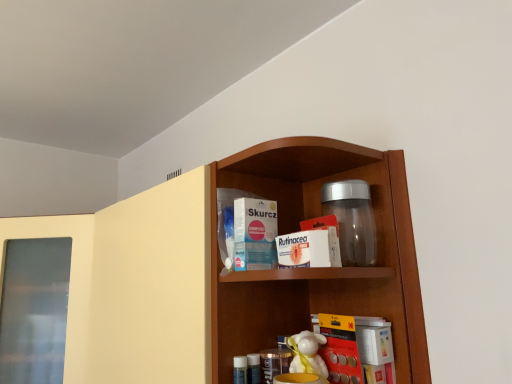
Question: Is wooden shelf at center turned away from yellow matte book at lower center?

Choices:
 (A) yes
 (B) no

Answer: (B)

Question: From the image's perspective, is wooden shelf at center on yellow matte book at lower center?

Choices:
 (A) no
 (B) yes

Answer: (A)

Question: Is wooden shelf at center wider than yellow matte book at lower center?

Choices:
 (A) no
 (B) yes

Answer: (B)

Question: Is yellow matte book at lower center a part of wooden shelf at center?

Choices:
 (A) no
 (B) yes

Answer: (A)

Question: From the image's perspective, is wooden shelf at center located beneath yellow matte book at lower center?

Choices:
 (A) yes
 (B) no

Answer: (A)

Question: Is wooden shelf at center taller than yellow matte book at lower center?

Choices:
 (A) no
 (B) yes

Answer: (B)

Question: Is yellow matte book at lower center facing towards white paper packet at center, which is the second product from right to left?

Choices:
 (A) no
 (B) yes

Answer: (A)

Question: From the image's perspective, would you say yellow matte book at lower center is positioned over white paper packet at center, which is the second product from right to left?

Choices:
 (A) no
 (B) yes

Answer: (A)

Question: Is yellow matte book at lower center completely or partially outside of white paper packet at center, which is the second product from right to left?

Choices:
 (A) yes
 (B) no

Answer: (A)

Question: Can you confirm if yellow matte book at lower center is positioned to the left of white paper packet at center, which is the second product from right to left?

Choices:
 (A) no
 (B) yes

Answer: (A)

Question: Can you confirm if yellow matte book at lower center is shorter than white paper packet at center, acting as the 1th product starting from the left?

Choices:
 (A) no
 (B) yes

Answer: (A)

Question: From a real-world perspective, is yellow matte book at lower center positioned under white paper packet at center, which is the second product from right to left, based on gravity?

Choices:
 (A) no
 (B) yes

Answer: (B)

Question: Is yellow matte book at lower center positioned with its back to wooden shelf at center?

Choices:
 (A) no
 (B) yes

Answer: (A)